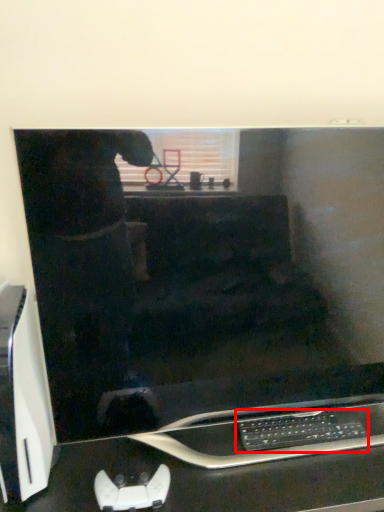
Question: From the image's perspective, what is the correct spatial relationship of computer keyboard (annotated by the red box) in relation to computer desk?

Choices:
 (A) above
 (B) below

Answer: (A)